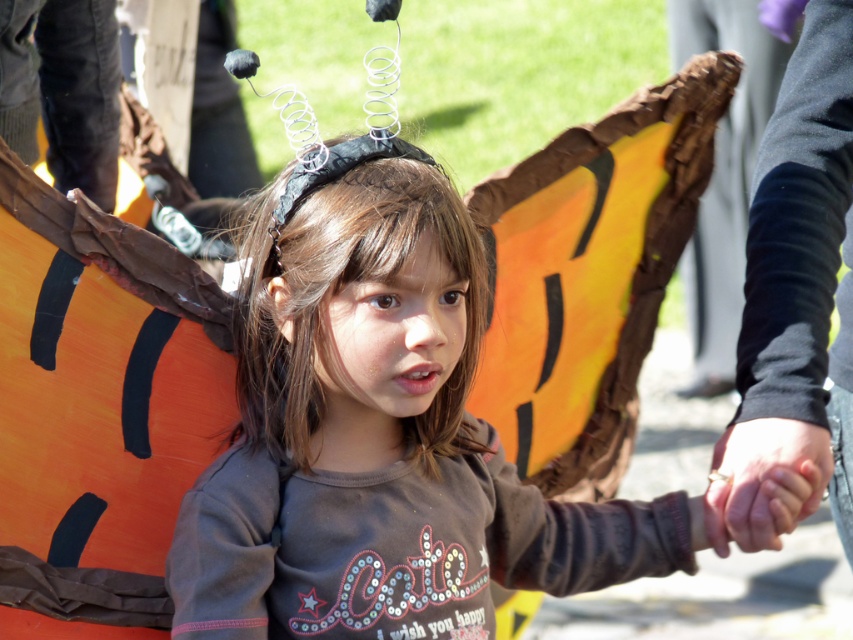
Question: Does matte brown shirt at center come behind smooth skin hand at center?

Choices:
 (A) yes
 (B) no

Answer: (B)

Question: Among these objects, which one is nearest to the camera?

Choices:
 (A) smooth skin hand at center
 (B) matte brown shirt at center

Answer: (B)

Question: Can you confirm if matte brown shirt at center is smaller than smooth skin hand at center?

Choices:
 (A) no
 (B) yes

Answer: (A)

Question: Is matte brown shirt at center smaller than smooth skin hand at center?

Choices:
 (A) no
 (B) yes

Answer: (A)